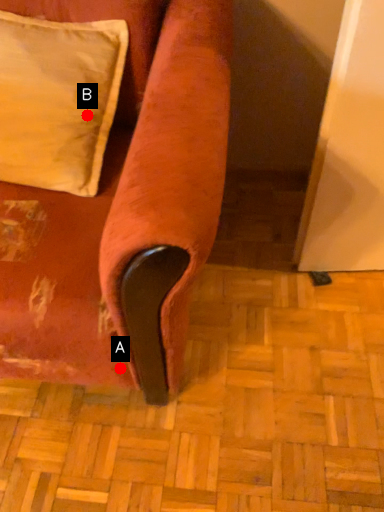
Question: Two points are circled on the image, labeled by A and B beside each circle. Which point is farther to the camera?

Choices:
 (A) A is further
 (B) B is further

Answer: (B)